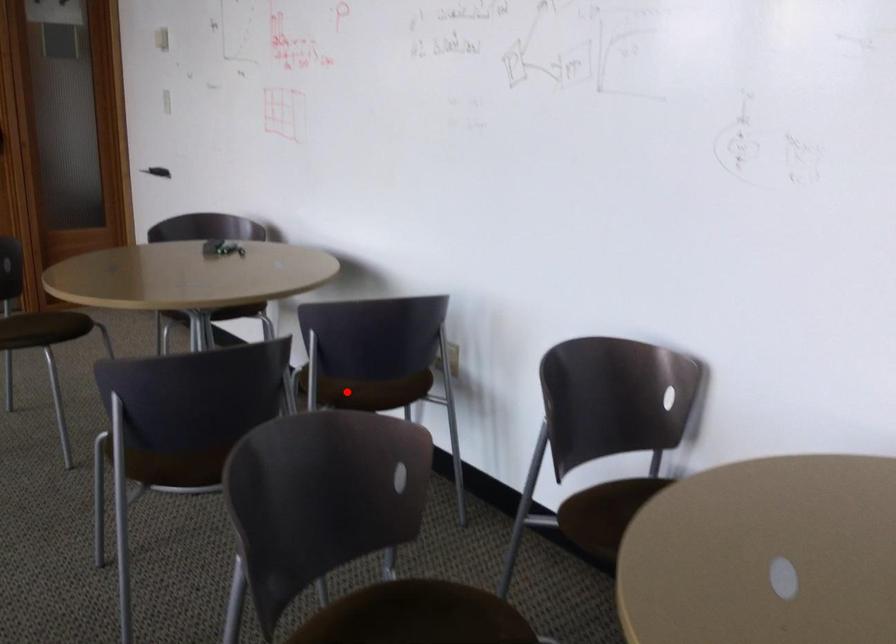
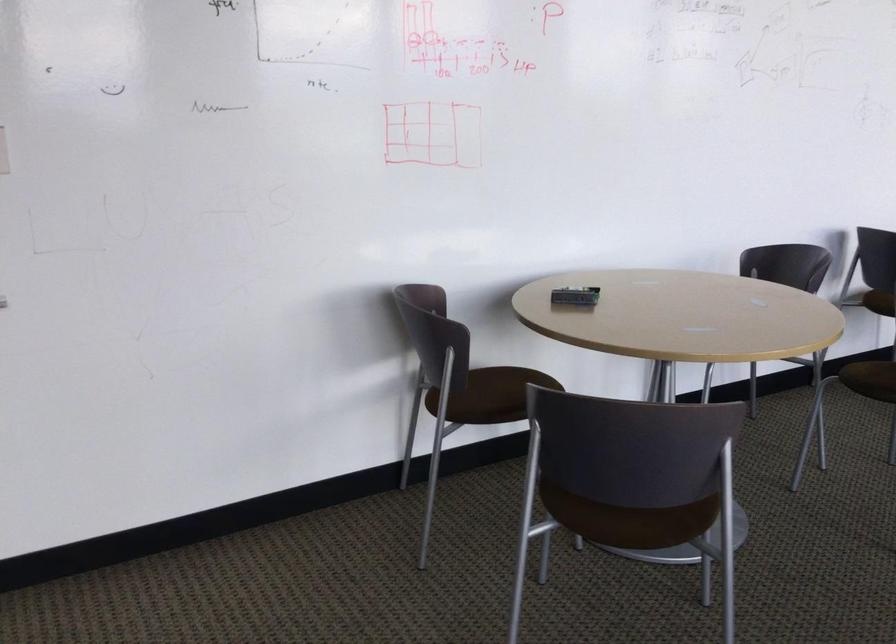
Question: I am providing you with two images of the same scene from different viewpoints. A red point is marked on the first image. Can you still see the location of the red point in image 2?

Choices:
 (A) Yes
 (B) No

Answer: (B)